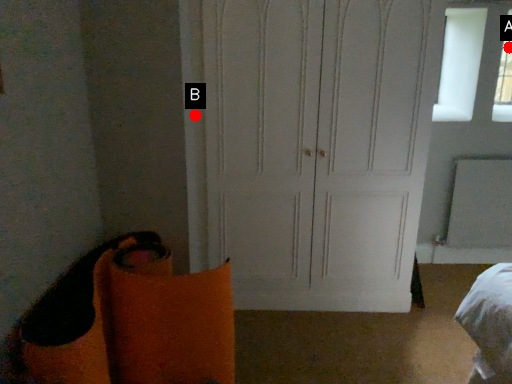
Question: Two points are circled on the image, labeled by A and B beside each circle. Which of the following is the farthest from the observer?

Choices:
 (A) A is further
 (B) B is further

Answer: (A)